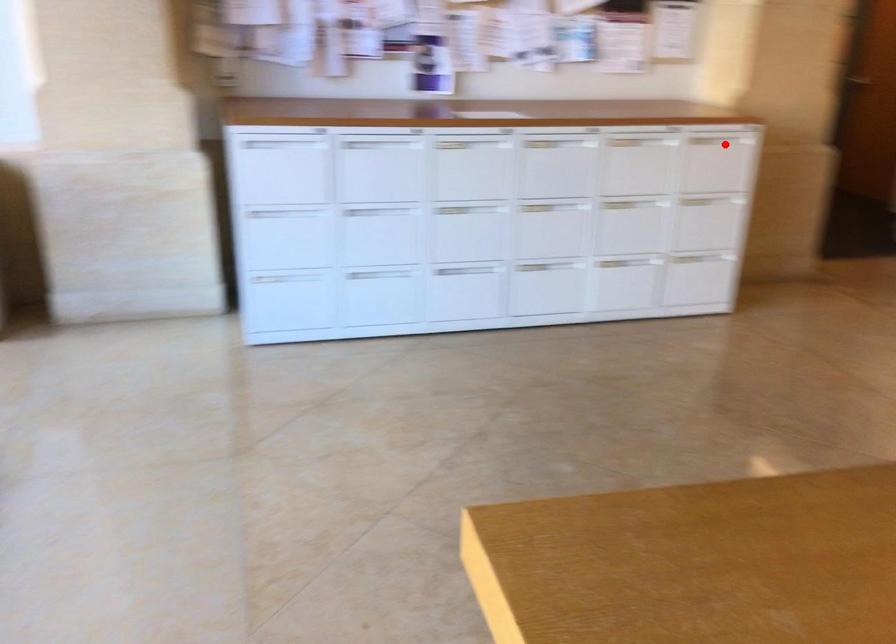
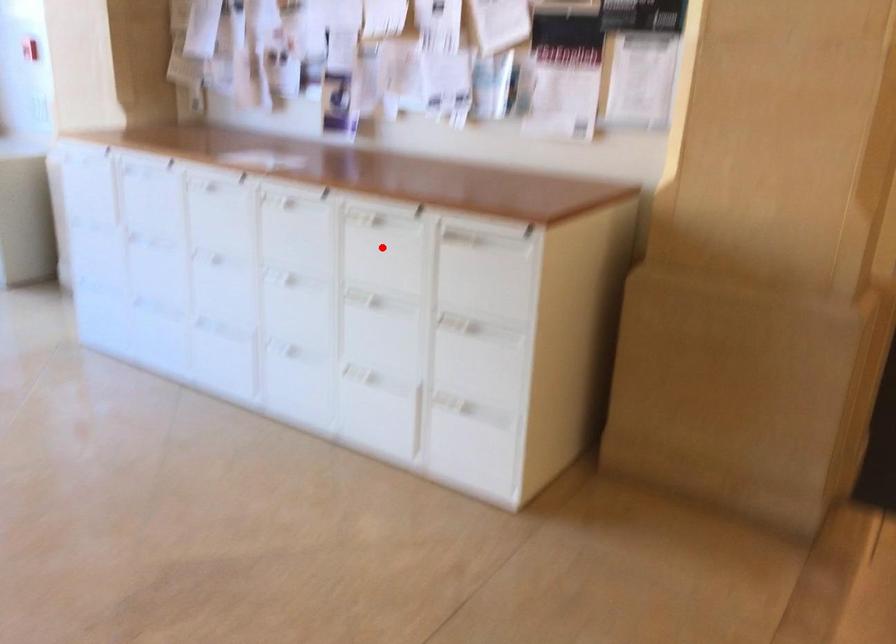
In the scene shown: I am providing you with two images of the same scene from different viewpoints. A red point is marked on the first image and another point is marked on the second image. Is the red point in image1 aligned with the point shown in image2?

No